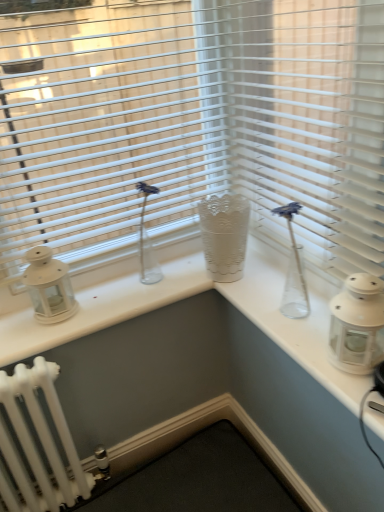
Question: Considering the relative sizes of white matte lantern at left, placed as the 2th candle holder when sorted from front to back, and white plastic blinds at upper center in the image provided, is white matte lantern at left, placed as the 2th candle holder when sorted from front to back, wider than white plastic blinds at upper center?

Choices:
 (A) no
 (B) yes

Answer: (A)

Question: Does white matte lantern at left, placed as the 2th candle holder when sorted from front to back, have a smaller size compared to white plastic blinds at upper center?

Choices:
 (A) no
 (B) yes

Answer: (B)

Question: Is white matte lantern at left, placed as the 2th candle holder when sorted from front to back, to the right of white plastic blinds at upper center from the viewer's perspective?

Choices:
 (A) no
 (B) yes

Answer: (A)

Question: Can you confirm if white matte lantern at left, which is the first candle holder in back-to-front order, is positioned to the left of white plastic blinds at upper center?

Choices:
 (A) no
 (B) yes

Answer: (B)

Question: From the image's perspective, does white matte lantern at left, which is the first candle holder in back-to-front order, appear higher than white plastic blinds at upper center?

Choices:
 (A) yes
 (B) no

Answer: (B)

Question: From a real-world perspective, is white matte lantern at left, which is the second candle holder in right-to-left order, above or below white plastic blinds at center?

Choices:
 (A) above
 (B) below

Answer: (B)

Question: Is white matte lantern at left, positioned as the first candle holder in left-to-right order, bigger or smaller than white plastic blinds at center?

Choices:
 (A) small
 (B) big

Answer: (A)

Question: Considering the positions of white matte lantern at left, which is the first candle holder in back-to-front order, and white plastic blinds at center in the image, is white matte lantern at left, which is the first candle holder in back-to-front order, taller or shorter than white plastic blinds at center?

Choices:
 (A) tall
 (B) short

Answer: (B)

Question: Visually, is white matte lantern at left, which is the first candle holder in back-to-front order, positioned to the left or to the right of white plastic blinds at center?

Choices:
 (A) left
 (B) right

Answer: (A)

Question: Is white plastic blinds at center taller or shorter than white plastic blinds at upper center?

Choices:
 (A) short
 (B) tall

Answer: (A)

Question: From the image's perspective, is white plastic blinds at center above or below white plastic blinds at upper center?

Choices:
 (A) above
 (B) below

Answer: (B)

Question: Is point (269, 227) closer or farther from the camera than point (243, 159)?

Choices:
 (A) closer
 (B) farther

Answer: (A)

Question: Considering the positions of white plastic blinds at center and white plastic blinds at upper center in the image, is white plastic blinds at center wider or thinner than white plastic blinds at upper center?

Choices:
 (A) thin
 (B) wide

Answer: (A)

Question: Would you say white plastic blinds at center is to the left or to the right of white glass lantern at right, which appears as the first candle holder when viewed from the right, in the picture?

Choices:
 (A) left
 (B) right

Answer: (A)

Question: Considering their positions, is white plastic blinds at center located in front of or behind white glass lantern at right, the 2th candle holder in the left-to-right sequence?

Choices:
 (A) front
 (B) behind

Answer: (A)